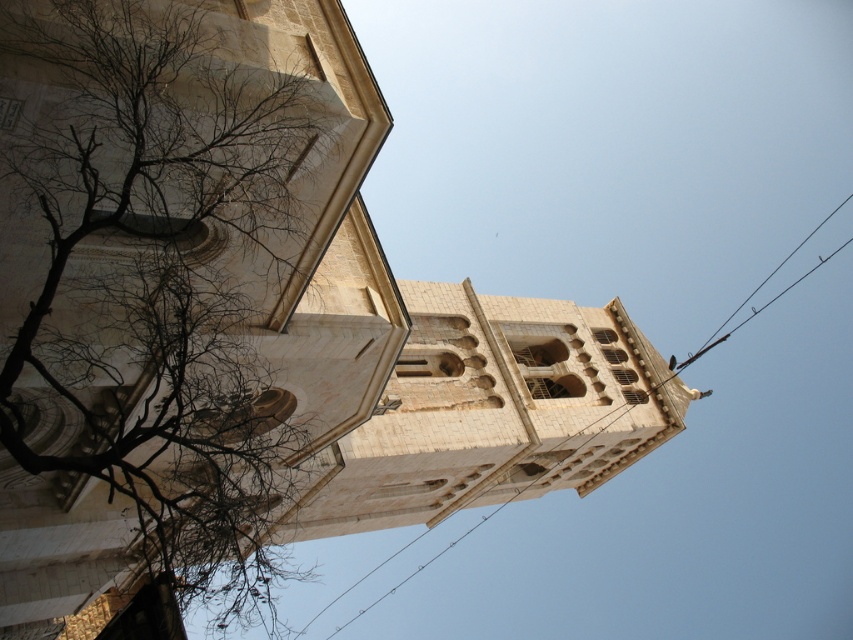
Question: Which object is farther from the camera taking this photo?

Choices:
 (A) black wire at upper right
 (B) bare branches at left

Answer: (A)

Question: Is bare branches at left thinner than black wire at upper center?

Choices:
 (A) no
 (B) yes

Answer: (B)

Question: Which of the following is the closest to the observer?

Choices:
 (A) [241, 234]
 (B) [730, 332]

Answer: (A)

Question: Is bare branches at left bigger than black wire at upper right?

Choices:
 (A) no
 (B) yes

Answer: (A)

Question: Observing the image, what is the correct spatial positioning of bare branches at left in reference to black wire at upper center?

Choices:
 (A) above
 (B) below

Answer: (A)

Question: Which point is closer to the camera?

Choices:
 (A) (146, 454)
 (B) (808, 237)

Answer: (A)